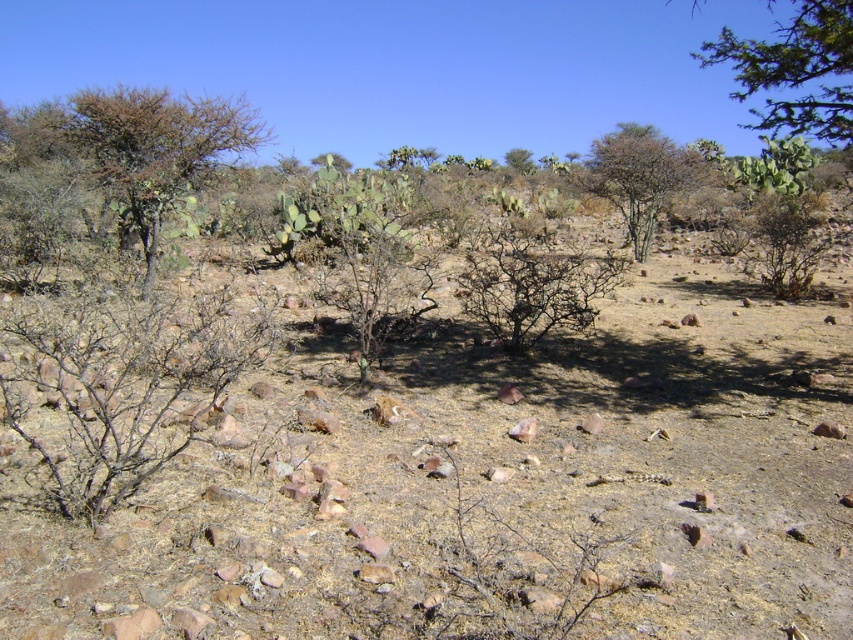
Is dried dirt at center to the right of brown dry bush at center from the viewer's perspective?

Incorrect, dried dirt at center is not on the right side of brown dry bush at center.

Between point (370, 438) and point (500, 292), which one is positioned in front?

Positioned in front is point (370, 438).

Does point (473, 493) lie behind point (572, 323)?

No, (473, 493) is closer to viewer.

Where is `dried dirt at center`? Image resolution: width=853 pixels, height=640 pixels. dried dirt at center is located at coordinates click(x=483, y=490).

Between green leafy tree at upper right and brown dry bush at center, which one is positioned lower?

brown dry bush at center is lower down.

Can you confirm if green leafy tree at upper right is bigger than brown dry bush at center?

Yes.

In order to click on green leafy tree at upper right in this screenshot , I will do `click(795, 70)`.

Between brown dry bush at center and green leafy shrub at center, which one is positioned lower?

brown dry bush at center

Does brown dry bush at center appear under green leafy shrub at center?

Correct, brown dry bush at center is located below green leafy shrub at center.

What do you see at coordinates (532, 284) in the screenshot? The height and width of the screenshot is (640, 853). I see `brown dry bush at center` at bounding box center [532, 284].

Where is `brown dry bush at center`? brown dry bush at center is located at coordinates (532, 284).